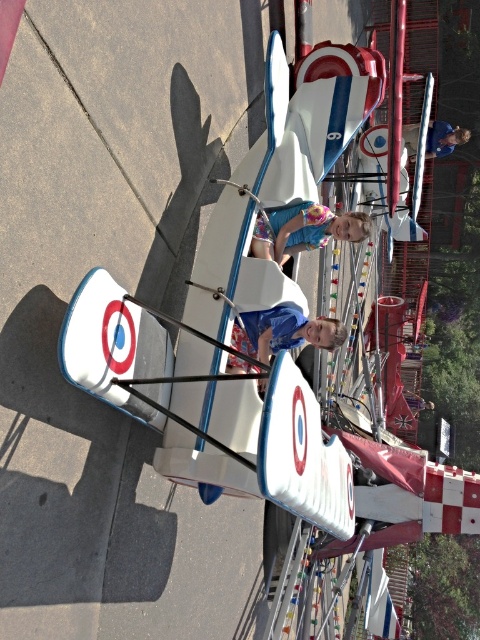
You are a photographer at the fairground and want to take a clear photo of the matte blue dress at center without the matte blue helmet at upper center blocking it. What should you do?

The matte blue dress at center is in front of the matte blue helmet at upper center, so you can move the camera position to the side to capture the dress without the helmet blocking the view.

You are a safety inspector at the fairground. You need to ensure that the blue matte shirt at center and the matte blue helmet at upper center are within a 10 meter safety zone for quick response. Can they be reached within the safety zone?

The distance between the blue matte shirt at center and the matte blue helmet at upper center is 9.85 meters, which is within the 10 meter safety zone. Both can be reached quickly.